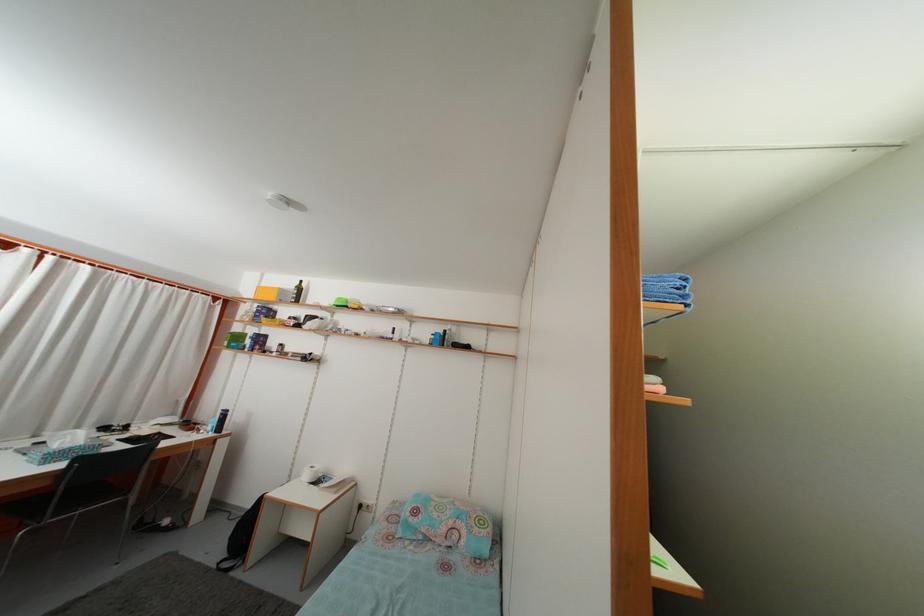
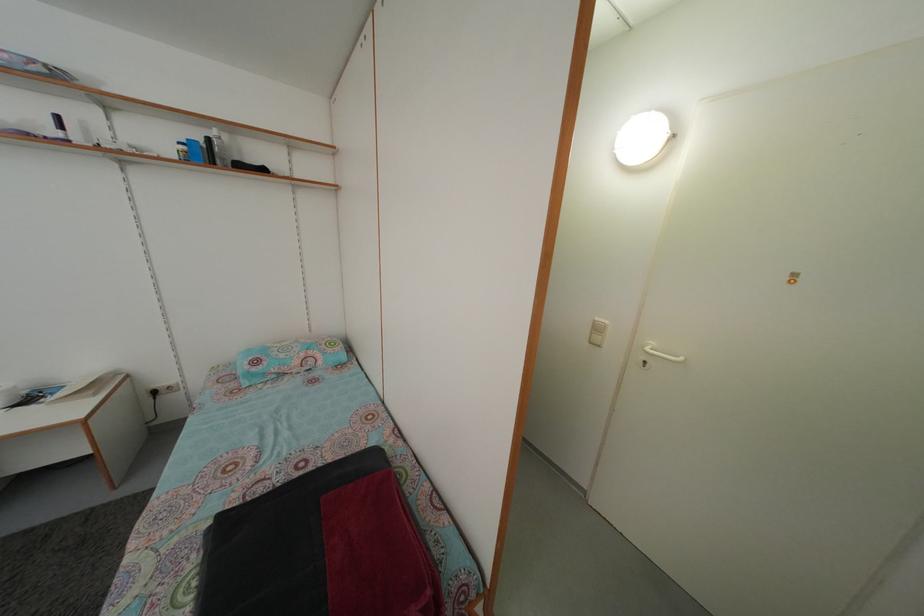
Locate, in the second image, the point that corresponds to pixel 451 339 in the first image.

(214, 148)